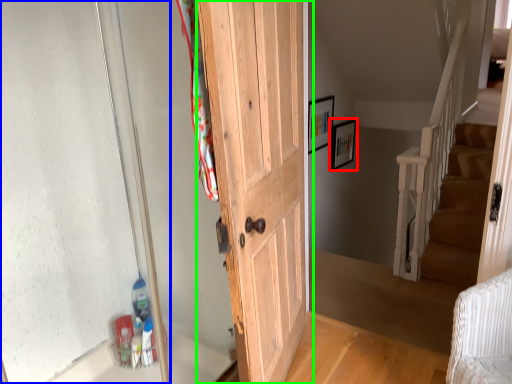
Question: Considering the real-world distances, which object is closest to picture frame (highlighted by a red box)? glass door (highlighted by a blue box) or door (highlighted by a green box).

Choices:
 (A) glass door
 (B) door

Answer: (B)